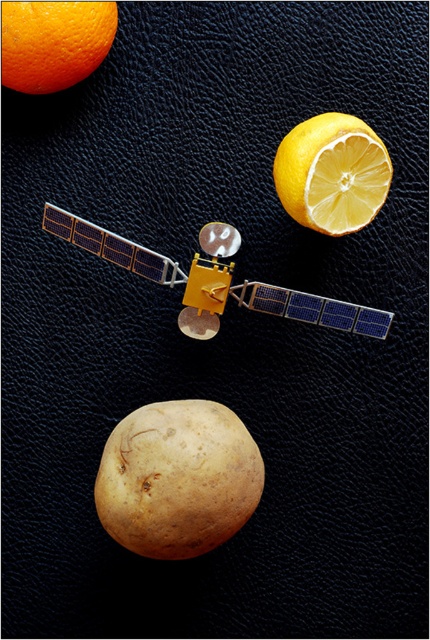
Who is more distant from viewer, [175,406] or [278,177]?

Point [278,177]

In the scene shown: Who is taller, smooth brown potato at center or yellow matte/sliced lemon at upper right?

smooth brown potato at center is taller.

Locate an element on the screen. smooth brown potato at center is located at coordinates (178, 477).

Does yellow matte/sliced lemon at upper right appear on the left side of orange matte at upper left?

In fact, yellow matte/sliced lemon at upper right is to the right of orange matte at upper left.

Who is taller, yellow matte/sliced lemon at upper right or orange matte at upper left?

With more height is yellow matte/sliced lemon at upper right.

Does point (326, 128) lie in front of point (61, 51)?

No, (326, 128) is behind (61, 51).

Locate an element on the screen. This screenshot has height=640, width=430. yellow matte/sliced lemon at upper right is located at coordinates (331, 173).

Consider the image. Is smooth brown potato at center bigger than orange matte at upper left?

Indeed, smooth brown potato at center has a larger size compared to orange matte at upper left.

Can you confirm if smooth brown potato at center is shorter than orange matte at upper left?

Incorrect, smooth brown potato at center's height does not fall short of orange matte at upper left's.

Is point (254, 467) less distant than point (92, 17)?

No, it is behind (92, 17).

This screenshot has height=640, width=430. Identify the location of smooth brown potato at center. point(178,477).